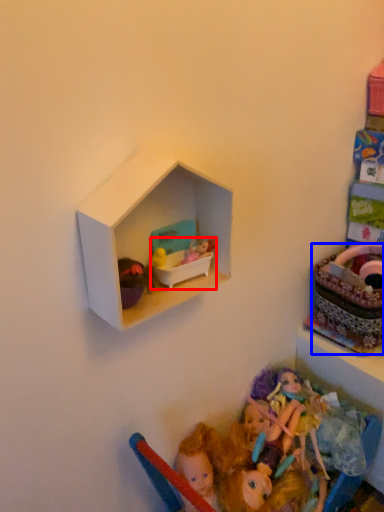
Question: Which object is further to the camera taking this photo, toy (highlighted by a red box) or basket (highlighted by a blue box)?

Choices:
 (A) toy
 (B) basket

Answer: (B)